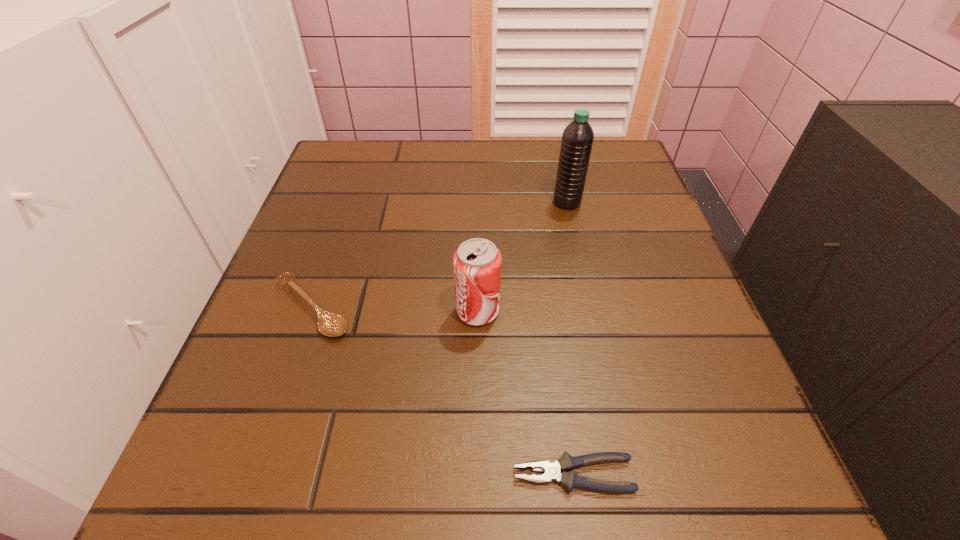
The height and width of the screenshot is (540, 960). What are the coordinates of `vacant space at the near edge of the desktop` in the screenshot? It's located at (543, 489).

This screenshot has width=960, height=540. In order to click on free space at the left edge of the desktop in this screenshot , I will do `click(352, 303)`.

Where is `free point at the right edge`? free point at the right edge is located at coordinates (635, 221).

You are a GUI agent. You are given a task and a screenshot of the screen. Output one action in this format:
    pyautogui.click(x=<x>, y=<y>)
    Task: Click on the vacant point at the far left corner
    
    Given the screenshot: What is the action you would take?
    pyautogui.click(x=387, y=173)

Locate an element on the screen. Image resolution: width=960 pixels, height=540 pixels. vacant space at the far right corner is located at coordinates (602, 183).

Where is `vacant area between the soda can and the third tallest object`? The image size is (960, 540). vacant area between the soda can and the third tallest object is located at coordinates (395, 309).

At what (x,y) coordinates should I click in order to perform the action: click on vacant area that lies between the shortest object and the leftmost object. Please return your answer as a coordinate pair (x, y). This screenshot has height=540, width=960. Looking at the image, I should click on (443, 391).

The height and width of the screenshot is (540, 960). What are the coordinates of `free area in between the nearest object and the third tallest object` in the screenshot? It's located at (443, 391).

You are a GUI agent. You are given a task and a screenshot of the screen. Output one action in this format:
    pyautogui.click(x=<x>, y=<y>)
    Task: Click on the vacant region between the shortest object and the leftmost object
    The image size is (960, 540).
    Given the screenshot: What is the action you would take?
    pyautogui.click(x=443, y=391)

I want to click on free space between the leftmost object and the nearest object, so click(443, 391).